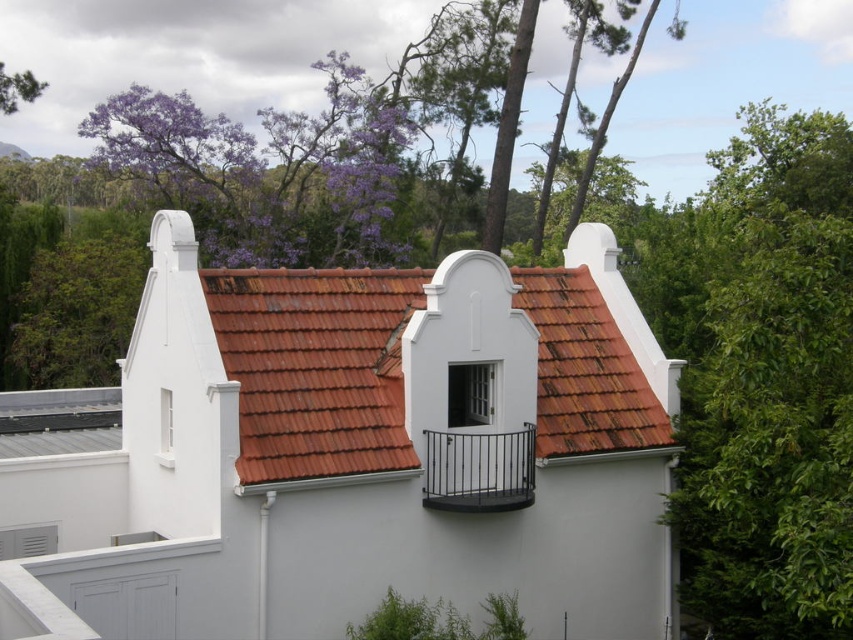
You are standing in front of the building and want to reach the black metal balcony at center. If your maximum reach is 2 meters, can you touch it?

The black metal balcony at center is 19.93 meters from viewer, which is much farther than your 2 meter reach. You cannot touch it.

You are standing in front of the building and want to take a photo that includes both the green leafy tree at right and the purple leafy tree at upper left. Which tree should you position closer to the bottom of your camera frame?

The green leafy tree at right should be positioned closer to the bottom of your camera frame because it is located below the purple leafy tree at upper left.